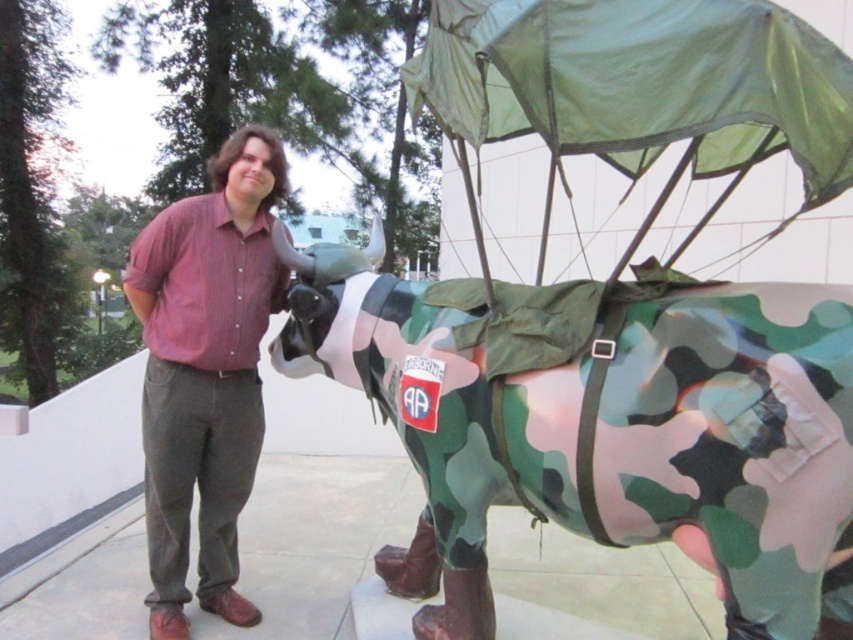
Does camouflage fabric cow at right have a lesser width compared to matte red shirt at center?

In fact, camouflage fabric cow at right might be wider than matte red shirt at center.

Between camouflage fabric cow at right and matte red shirt at center, which one appears on the right side from the viewer's perspective?

Positioned to the right is camouflage fabric cow at right.

Which is behind, point (688, 388) or point (199, 449)?

The point (199, 449) is more distant.

The image size is (853, 640). Find the location of `camouflage fabric cow at right`. camouflage fabric cow at right is located at coordinates (601, 422).